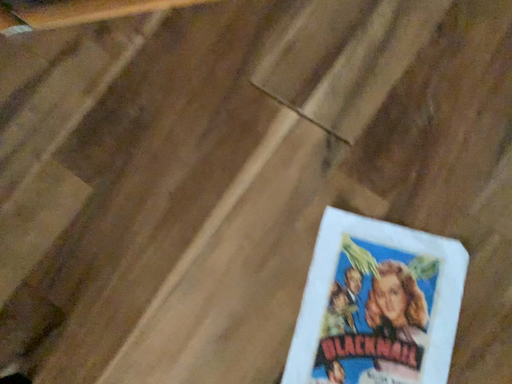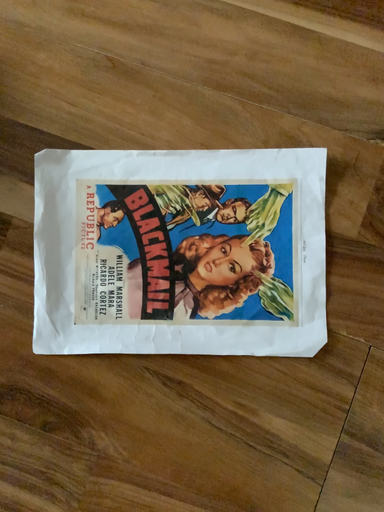
Question: How did the camera likely rotate when shooting the video?

Choices:
 (A) rotated right
 (B) rotated left

Answer: (B)